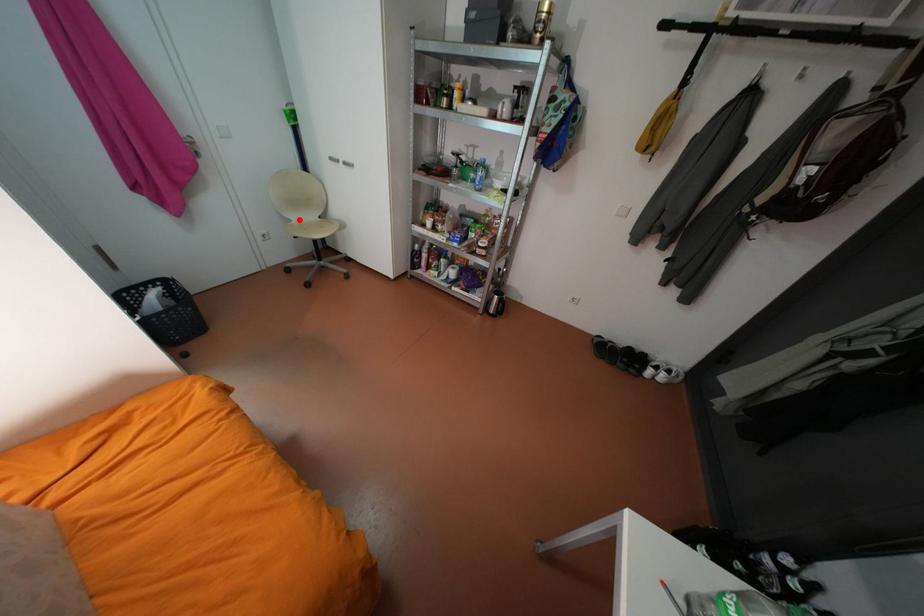
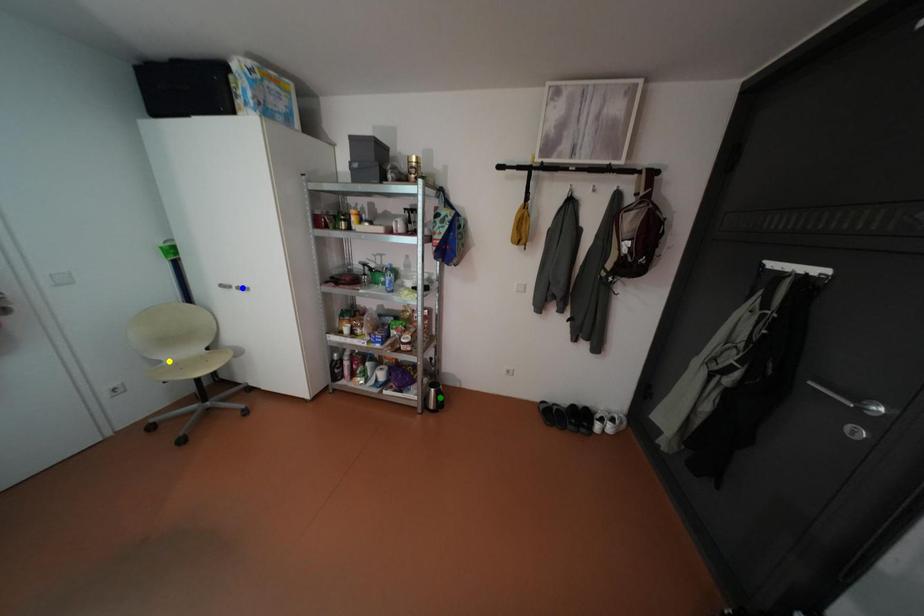
Question: I am providing you with two images of the same scene from different viewpoints. A red point is marked on the first image. You are given multiple points on the second image. Can you choose the point in image 2 that corresponds to the point in image 1?

Choices:
 (A) green point
 (B) yellow point
 (C) blue point

Answer: (B)